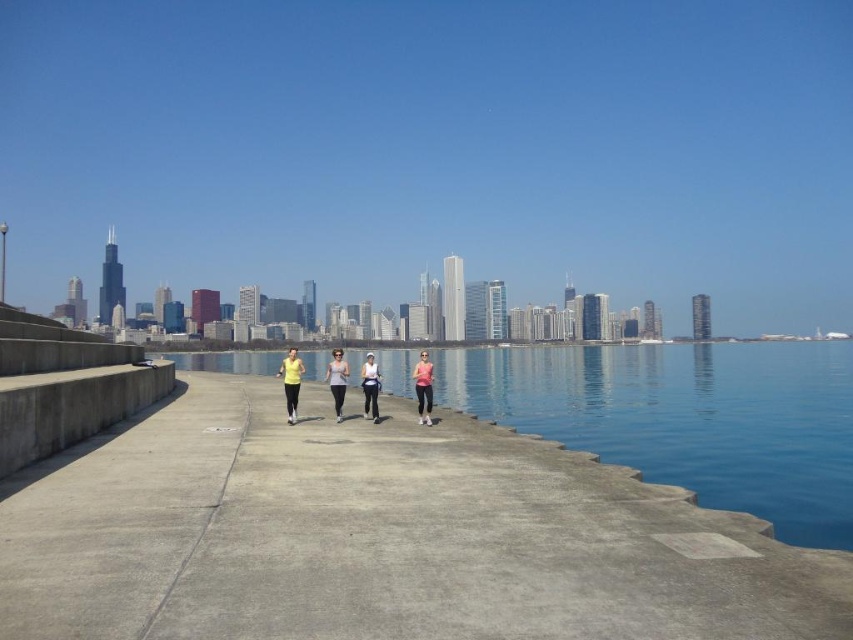
You are a photographer positioned at the waterfront and want to capture a photo of both the white matte tank top at center and the matte white tank top at center. Which one will appear closer to you in the photo?

The white matte tank top at center will appear closer to you in the photo because it is positioned further to the viewer than the matte white tank top at center.

You are a photographer standing on the concrete pathway and want to take a photo of the matte yellow shirt at center and the matte white tank top at center. If your camera has a maximum focus range of 3 meters, will both subjects be in focus?

The matte yellow shirt at center is 3.32 meters away from the matte white tank top at center. Since the distance between them exceeds the camera maximum focus range of 3 meters, both subjects will not be in focus.

You are a photographer standing on the waterfront pathway. You see the matte yellow shirt at center and the pink matte tank top at center. Which person should you focus on to capture a clear photo without blurring the background?

The matte yellow shirt at center is closer to the viewer than the pink matte tank top at center, so focusing on the matte yellow shirt at center will keep it sharp while blurring the background more effectively.